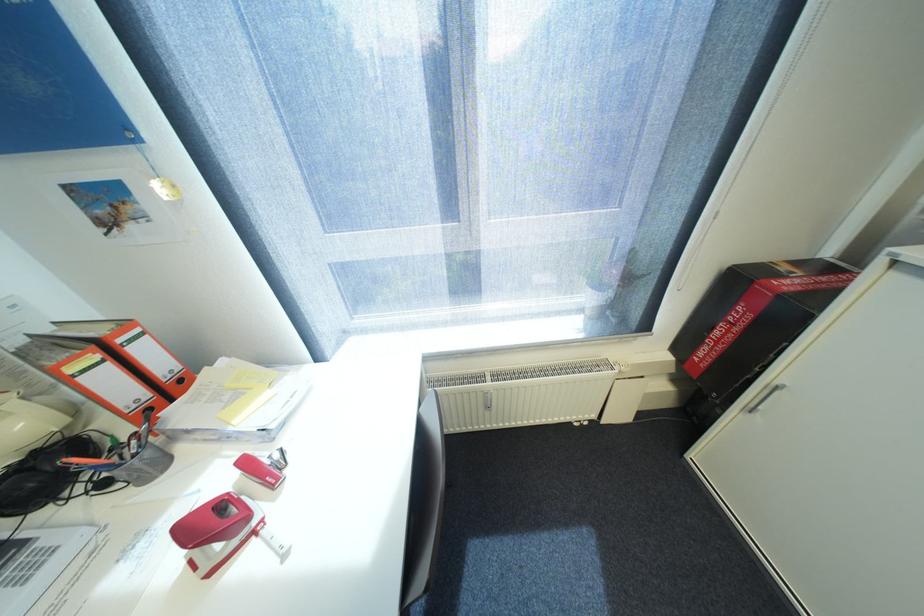
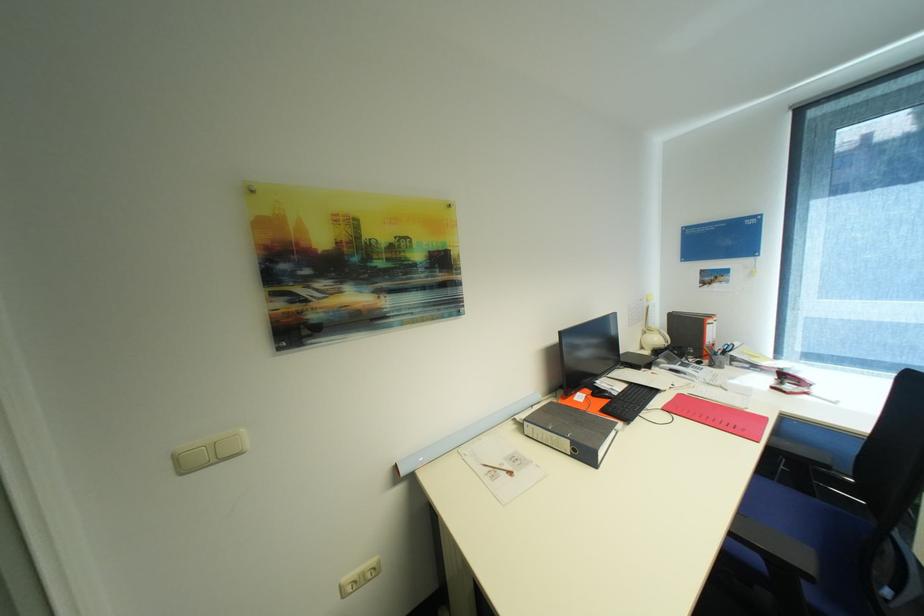
Where in the second image is the point corresponding to point 261,533 from the first image?

(813, 394)